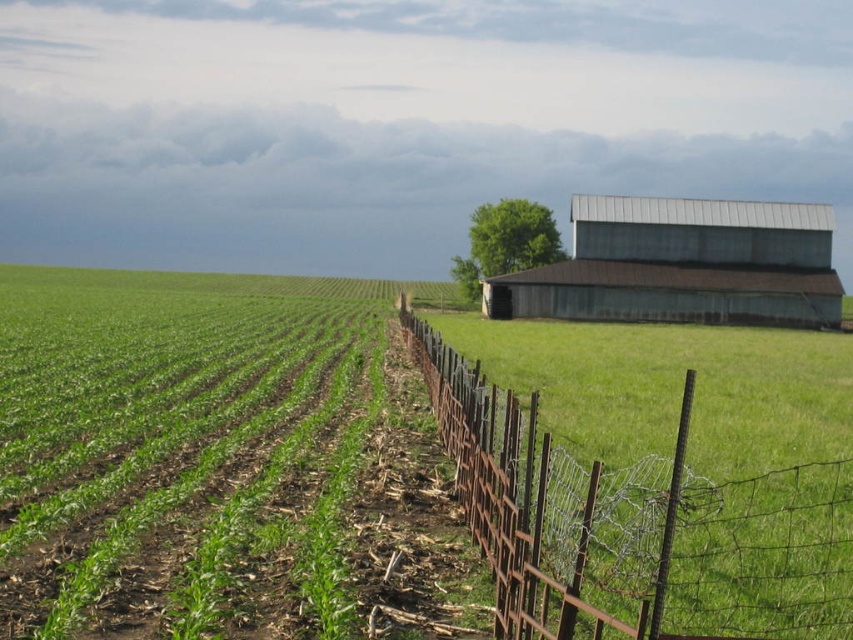
Who is lower down, green grass at center or rusty wire fence at right?

Positioned lower is rusty wire fence at right.

Is point (352, 579) behind point (403, 333)?

No, it is not.

Who is more distant from viewer, [561,600] or [515,596]?

Positioned behind is point [561,600].

You are a GUI agent. You are given a task and a screenshot of the screen. Output one action in this format:
    pyautogui.click(x=<x>, y=<y>)
    Task: Click on the green grass at center
    This screenshot has height=640, width=853.
    Given the screenshot: What is the action you would take?
    pyautogui.click(x=207, y=458)

Does green grass at center appear over rusty corrugated metal barn at right?

Actually, green grass at center is below rusty corrugated metal barn at right.

Is green grass at center bigger than rusty corrugated metal barn at right?

Indeed, green grass at center has a larger size compared to rusty corrugated metal barn at right.

Locate an element on the screen. green grass at center is located at coordinates (207, 458).

At what (x,y) coordinates should I click in order to perform the action: click on green grass at center. Please return your answer as a coordinate pair (x, y). This screenshot has height=640, width=853. Looking at the image, I should click on (207, 458).

Consider the image. Is rusty wire fence at right in front of rusty corrugated metal barn at right?

Yes, rusty wire fence at right is closer to the viewer.

Between point (724, 604) and point (834, 310), which one is positioned in front?

Point (724, 604)

Locate an element on the screen. Image resolution: width=853 pixels, height=640 pixels. rusty wire fence at right is located at coordinates (635, 525).